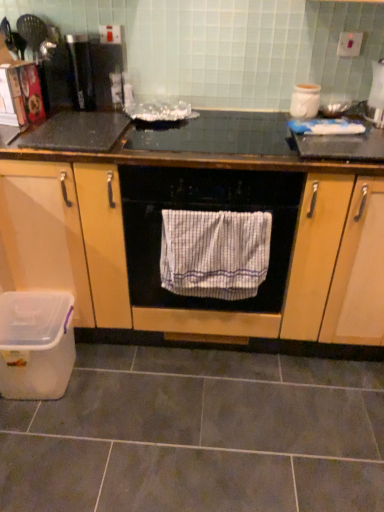
Question: Is gray matte tile at lower center turned away from white striped towel at center?

Choices:
 (A) no
 (B) yes

Answer: (A)

Question: From the image's perspective, is gray matte tile at lower center below white striped towel at center?

Choices:
 (A) no
 (B) yes

Answer: (B)

Question: Does gray matte tile at lower center have a lesser height compared to white striped towel at center?

Choices:
 (A) yes
 (B) no

Answer: (A)

Question: Is gray matte tile at lower center oriented towards white striped towel at center?

Choices:
 (A) yes
 (B) no

Answer: (B)

Question: Is gray matte tile at lower center to the right of white striped towel at center from the viewer's perspective?

Choices:
 (A) yes
 (B) no

Answer: (B)

Question: Looking at the image, does white glossy kettle at upper right, which appears as the 2th appliance when viewed from the left, seem bigger or smaller compared to transparent plastic container at lower left?

Choices:
 (A) small
 (B) big

Answer: (A)

Question: Which is correct: white glossy kettle at upper right, which appears as the first appliance when viewed from the right, is inside transparent plastic container at lower left, or outside of it?

Choices:
 (A) outside
 (B) inside

Answer: (A)

Question: Considering the positions of point (372, 97) and point (39, 349), is point (372, 97) closer or farther from the camera than point (39, 349)?

Choices:
 (A) farther
 (B) closer

Answer: (A)

Question: Is white glossy kettle at upper right, which appears as the 2th appliance when viewed from the left, taller or shorter than transparent plastic container at lower left?

Choices:
 (A) short
 (B) tall

Answer: (A)

Question: From the image's perspective, is wooden cabinet at center above or below white glossy jar at upper right, which is counted as the first appliance, starting from the left?

Choices:
 (A) below
 (B) above

Answer: (A)

Question: Do you think wooden cabinet at center is within white glossy jar at upper right, which appears as the 2th appliance when viewed from the right, or outside of it?

Choices:
 (A) inside
 (B) outside

Answer: (B)

Question: Considering the relative positions of wooden cabinet at center and white glossy jar at upper right, which appears as the 2th appliance when viewed from the right, in the image provided, is wooden cabinet at center to the left or to the right of white glossy jar at upper right, which appears as the 2th appliance when viewed from the right,?

Choices:
 (A) left
 (B) right

Answer: (A)

Question: Considering the positions of wooden cabinet at center and white glossy jar at upper right, which is counted as the first appliance, starting from the left, in the image, is wooden cabinet at center taller or shorter than white glossy jar at upper right, which is counted as the first appliance, starting from the left,?

Choices:
 (A) short
 (B) tall

Answer: (B)

Question: Relative to white glossy jar at upper right, which is counted as the first appliance, starting from the left, is white glossy kettle at upper right, which appears as the first appliance when viewed from the right, in front or behind?

Choices:
 (A) front
 (B) behind

Answer: (A)

Question: From the image's perspective, is white glossy kettle at upper right, which appears as the first appliance when viewed from the right, above or below white glossy jar at upper right, which appears as the 2th appliance when viewed from the right?

Choices:
 (A) below
 (B) above

Answer: (B)